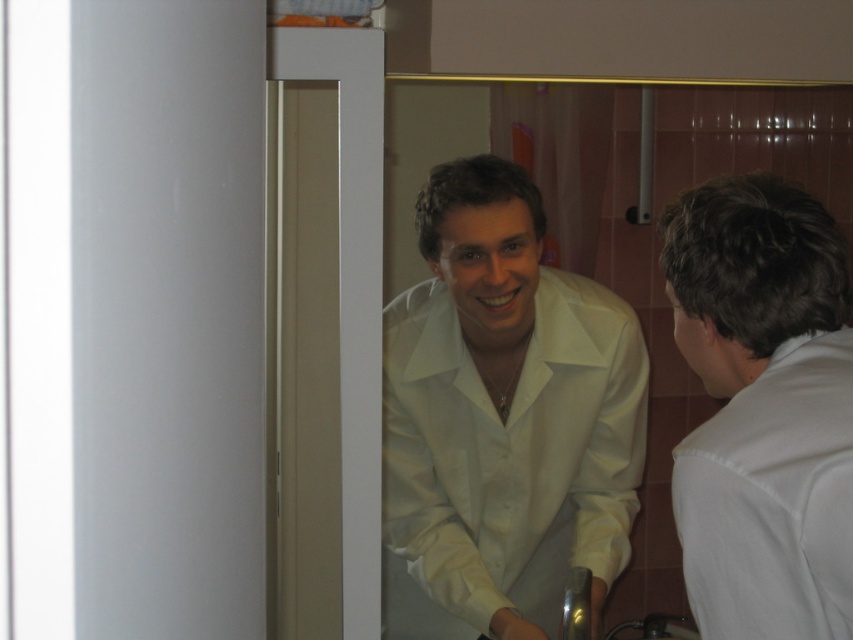
Between point (477, 406) and point (718, 588), which one is positioned in front?

Point (718, 588) is in front.

Between white glossy shirt at center and white matte shirt at right, which one is positioned lower?

white glossy shirt at center

The width and height of the screenshot is (853, 640). Describe the element at coordinates (502, 419) in the screenshot. I see `white glossy shirt at center` at that location.

Where is `white glossy shirt at center`? white glossy shirt at center is located at coordinates (502, 419).